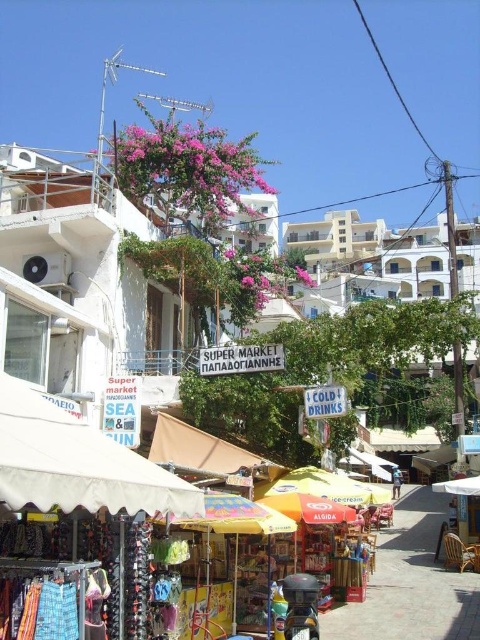
Does point (120, 449) lie in front of point (396, 486)?

Yes.

Does white fabric canopy at lower left lie behind yellow fabric umbrella at center?

No, it is not.

Is point (39, 497) farther from camera compared to point (398, 474)?

That is False.

Where is `white fabric canopy at lower left`? The image size is (480, 640). white fabric canopy at lower left is located at coordinates pyautogui.click(x=78, y=464).